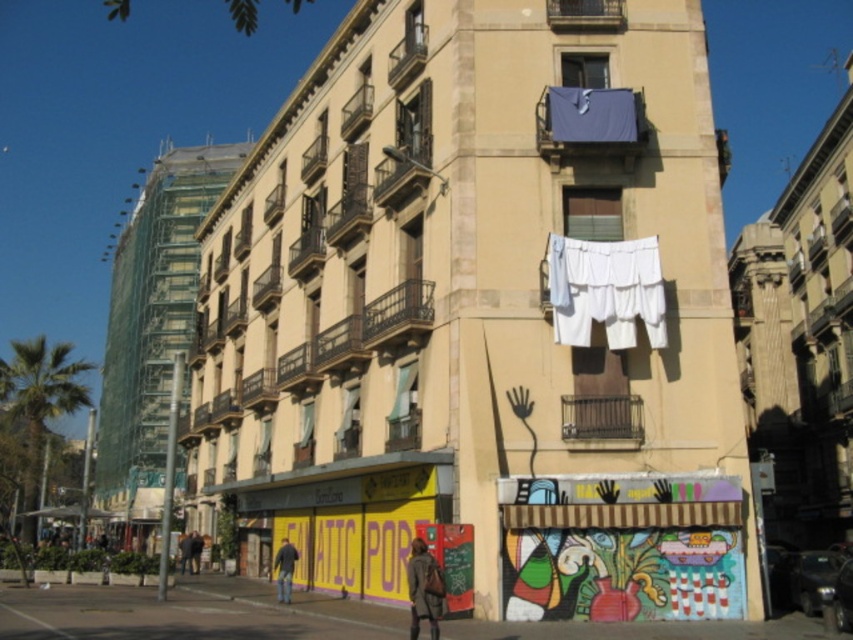
Is point (413, 616) positioned after point (291, 576)?

No, it is not.

Which is behind, point (438, 605) or point (281, 561)?

The point (281, 561) is more distant.

Locate an element on the screen. This screenshot has width=853, height=640. dark gray fabric jacket at lower center is located at coordinates (422, 589).

Which of these two, white fabric at upper center or denim jeans at lower center, stands shorter?

Standing shorter between the two is white fabric at upper center.

Is point (654, 273) closer to viewer compared to point (285, 548)?

Yes.

Is point (648, 278) less distant than point (294, 554)?

Yes, it is in front of point (294, 554).

Locate an element on the screen. Image resolution: width=853 pixels, height=640 pixels. white fabric at upper center is located at coordinates (605, 291).

Which is behind, point (570, 314) or point (427, 608)?

The point (570, 314) is behind.

What are the coordinates of `white fabric at upper center` in the screenshot? It's located at (605, 291).